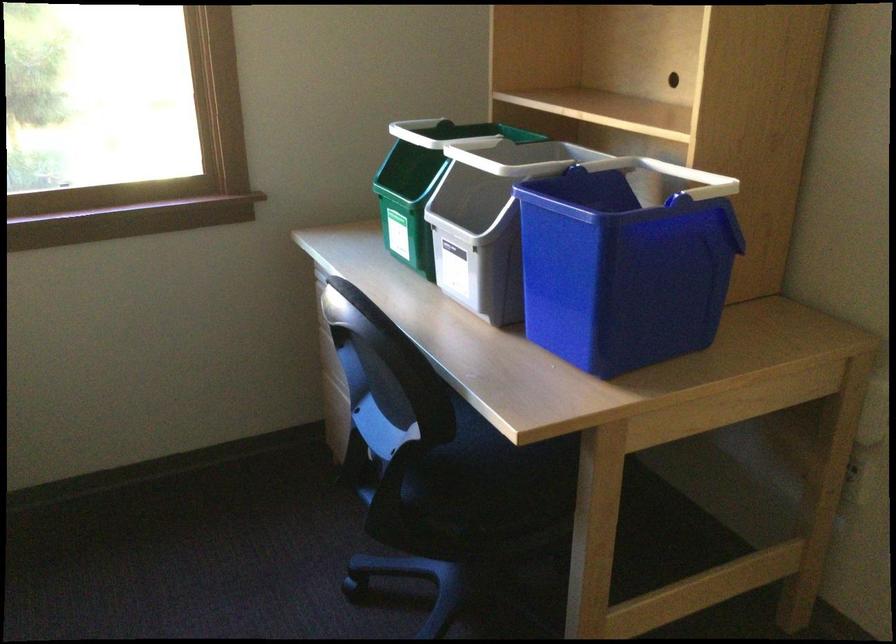
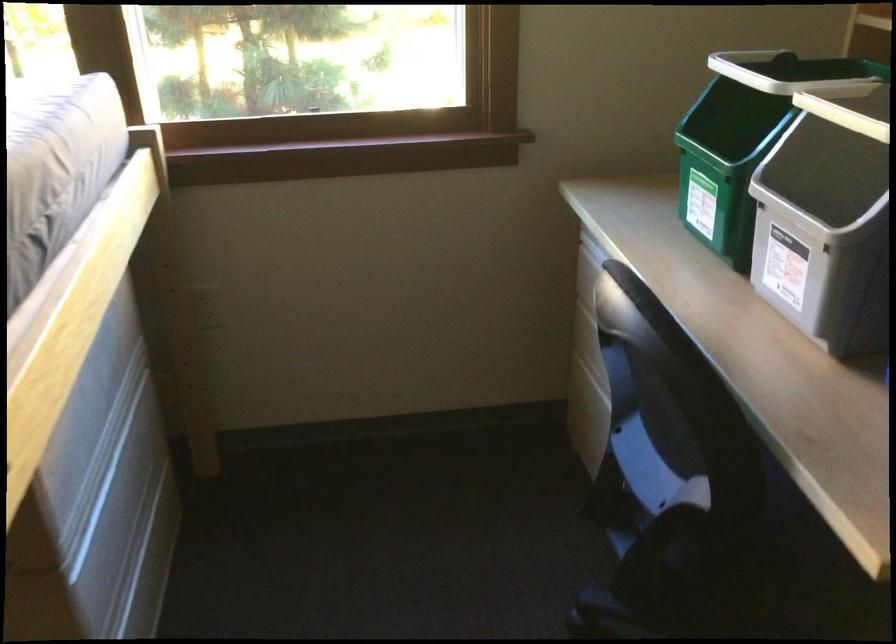
Question: In a continuous first-person perspective shot, in which direction is the camera moving?

Choices:
 (A) Left
 (B) Right
 (C) Forward
 (D) Backward

Answer: (C)